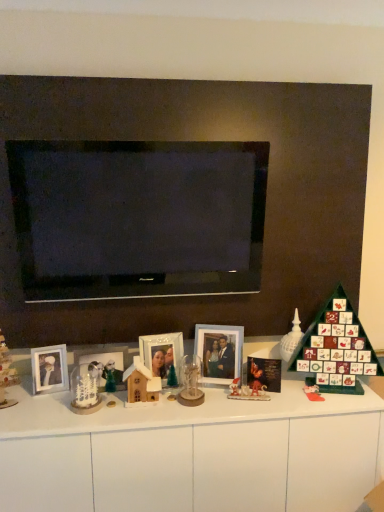
The height and width of the screenshot is (512, 384). I want to click on free space in front of clear glass candle holder at center, arranged as the 2th candle holder when viewed from the left, so click(185, 413).